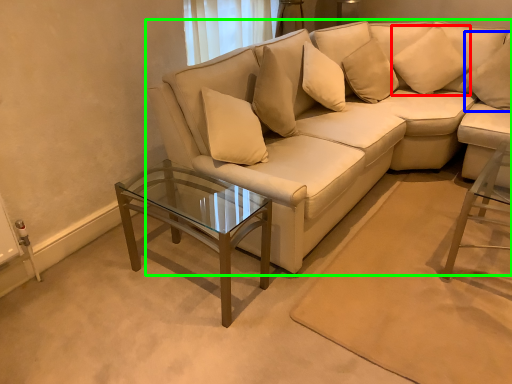
Question: Which object is positioned closest to pillow (highlighted by a red box)? Select from pillow (highlighted by a blue box) and studio couch (highlighted by a green box).

Choices:
 (A) pillow
 (B) studio couch

Answer: (A)